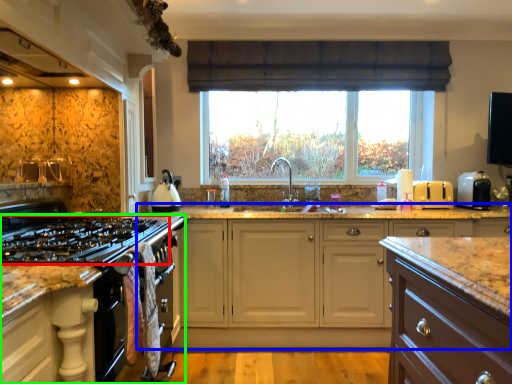
Question: Estimate the real-world distances between objects in this image. Which object is closer to gas stove (highlighted by a red box), cabinetry (highlighted by a blue box) or cabinetry (highlighted by a green box)?

Choices:
 (A) cabinetry
 (B) cabinetry

Answer: (B)